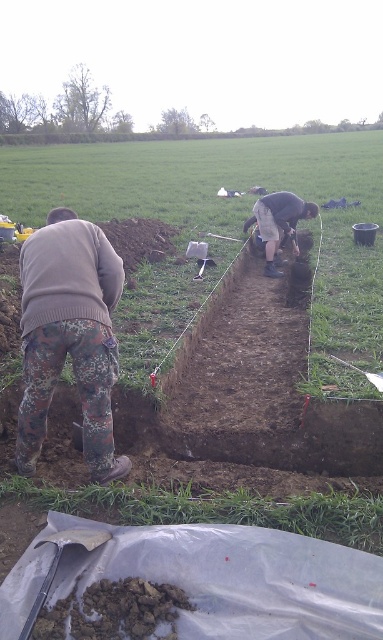
Question: Which object is farther from the camera taking this photo?

Choices:
 (A) dark gray concrete squat at center
 (B) camouflage pants at left

Answer: (A)

Question: Which of these objects is positioned farthest from the camouflage pants at left?

Choices:
 (A) black plastic shovel at lower left
 (B) dark gray concrete squat at center

Answer: (B)

Question: From the image, what is the correct spatial relationship of camouflage pants at left in relation to black plastic shovel at lower left?

Choices:
 (A) right
 (B) left

Answer: (B)

Question: Which object appears farthest from the camera in this image?

Choices:
 (A) black plastic shovel at lower left
 (B) dark gray concrete squat at center
 (C) camouflage pants at left

Answer: (B)

Question: Can you confirm if camouflage pants at left is thinner than dark gray concrete squat at center?

Choices:
 (A) yes
 (B) no

Answer: (A)

Question: Can you confirm if dark gray concrete squat at center is thinner than black plastic shovel at lower left?

Choices:
 (A) yes
 (B) no

Answer: (B)